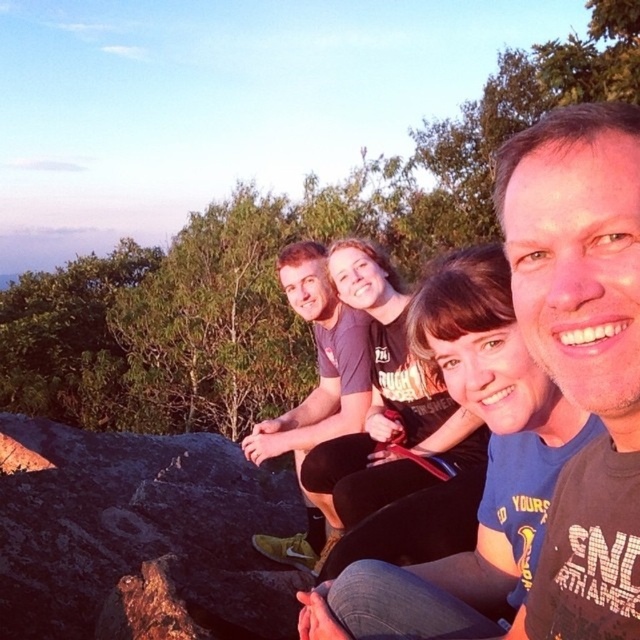
Does matte brown t-shirt at center have a larger size compared to dark blue t-shirt at center?

Incorrect, matte brown t-shirt at center is not larger than dark blue t-shirt at center.

Does matte brown t-shirt at center have a smaller size compared to dark blue t-shirt at center?

Yes, matte brown t-shirt at center is smaller than dark blue t-shirt at center.

Which is behind, point (637, 136) or point (525, 509)?

Point (525, 509)

You are a GUI agent. You are given a task and a screenshot of the screen. Output one action in this format:
    pyautogui.click(x=<x>, y=<y>)
    Task: Click on the matte brown t-shirt at center
    The width and height of the screenshot is (640, 640).
    Given the screenshot: What is the action you would take?
    580,352

Between point (593, 632) and point (356, 385), which one is positioned behind?

The point (356, 385) is more distant.

Where is `matte brown t-shirt at center`? This screenshot has width=640, height=640. matte brown t-shirt at center is located at coordinates (580, 352).

Where is `matte brown t-shirt at center`? The width and height of the screenshot is (640, 640). matte brown t-shirt at center is located at coordinates (580, 352).

Is dark blue t-shirt at center above matte gray t-shirt at center?

Yes, dark blue t-shirt at center is above matte gray t-shirt at center.

Who is lower down, dark blue t-shirt at center or matte gray t-shirt at center?

matte gray t-shirt at center

Which is in front, point (480, 346) or point (289, 438)?

Point (480, 346) is more forward.

Where is `dark blue t-shirt at center`? Image resolution: width=640 pixels, height=640 pixels. dark blue t-shirt at center is located at coordinates (484, 476).